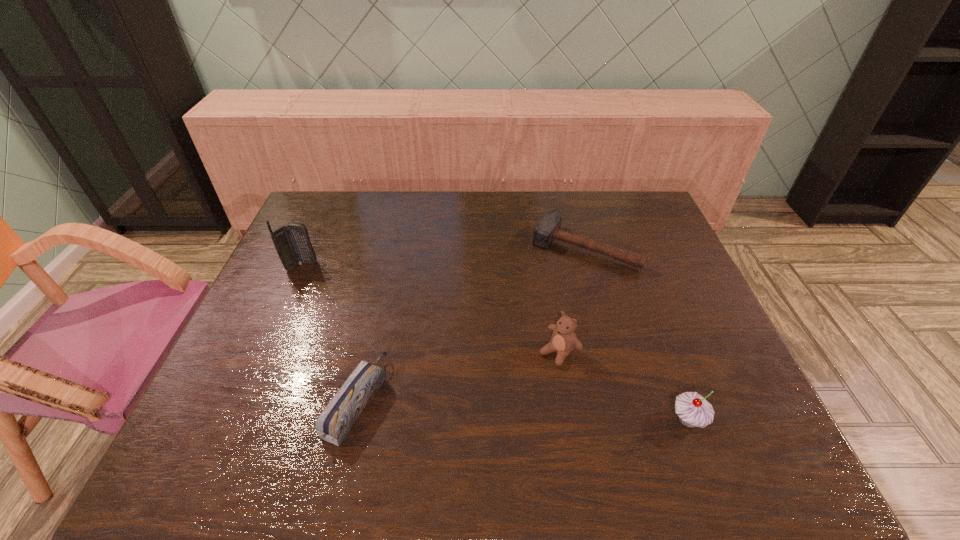
You are a GUI agent. You are given a task and a screenshot of the screen. Output one action in this format:
    pyautogui.click(x=<x>, y=<y>)
    Task: Click on the vacant point located between the cupcake and the cellular telephone
    The width and height of the screenshot is (960, 540).
    Given the screenshot: What is the action you would take?
    494,343

The height and width of the screenshot is (540, 960). Identify the location of object that ranks as the second closest to the hammer. (693, 410).

Identify the location of object that is the second closest to the cupcake. The width and height of the screenshot is (960, 540). (548, 229).

The height and width of the screenshot is (540, 960). In order to click on free location that satisfies the following two spatial constraints: 1. on the front side of the teddy bear; 2. on the left side of the cellular telephone in this screenshot , I will do `click(263, 352)`.

Where is `vacant space that satisfies the following two spatial constraints: 1. on the front side of the teddy bear; 2. on the left side of the cupcake`? This screenshot has width=960, height=540. vacant space that satisfies the following two spatial constraints: 1. on the front side of the teddy bear; 2. on the left side of the cupcake is located at coordinates (570, 420).

I want to click on vacant space that satisfies the following two spatial constraints: 1. on the back side of the hammer; 2. on the left side of the teddy bear, so click(x=542, y=247).